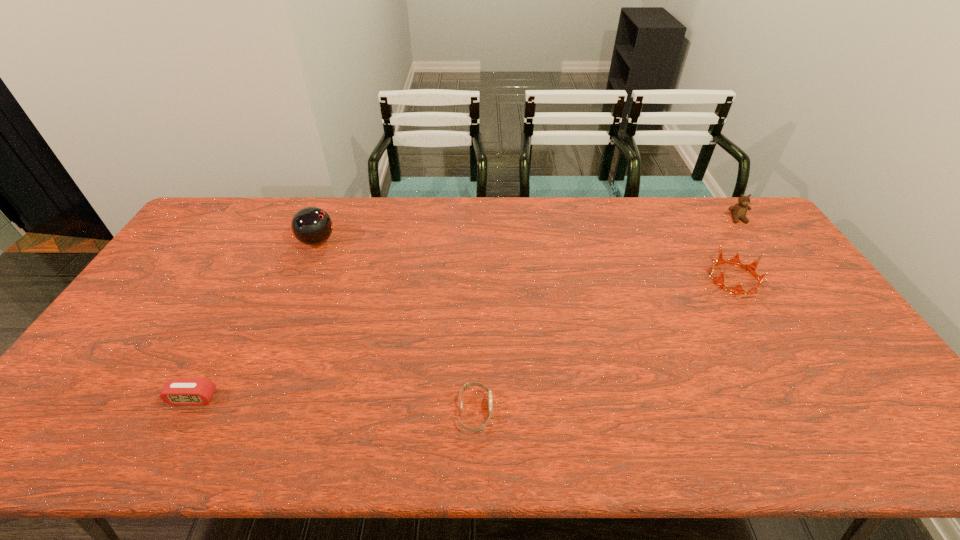
You are a GUI agent. You are given a task and a screenshot of the screen. Output one action in this format:
    pyautogui.click(x=<x>, y=<y>)
    Task: Click on the free point located 0.160m on the front of the crown
    
    Given the screenshot: What is the action you would take?
    pyautogui.click(x=771, y=341)

The image size is (960, 540). In order to click on vacant space situated 0.050m on the front-facing side of the leftmost object in this screenshot , I will do `click(179, 426)`.

Find the location of a particular element. vacant space situated 0.120m on the face of the third object from right to left is located at coordinates (543, 411).

I want to click on bowling ball at the far edge, so [312, 226].

Locate an element on the screen. The height and width of the screenshot is (540, 960). teddy bear at the far edge is located at coordinates (738, 211).

Where is `object that is positioned at the near edge`? The height and width of the screenshot is (540, 960). object that is positioned at the near edge is located at coordinates (467, 385).

The image size is (960, 540). I want to click on teddy bear situated at the right edge, so click(738, 211).

Where is `crown that is at the right edge`? The width and height of the screenshot is (960, 540). crown that is at the right edge is located at coordinates (751, 268).

Identify the location of object at the far right corner. The width and height of the screenshot is (960, 540). (738, 211).

This screenshot has height=540, width=960. I want to click on vacant space at the far edge of the desktop, so click(x=574, y=235).